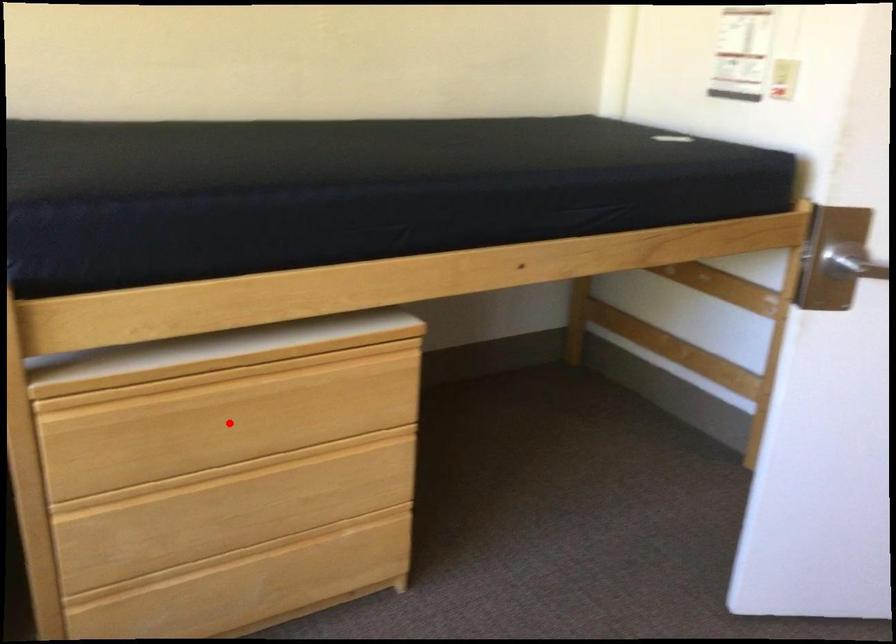
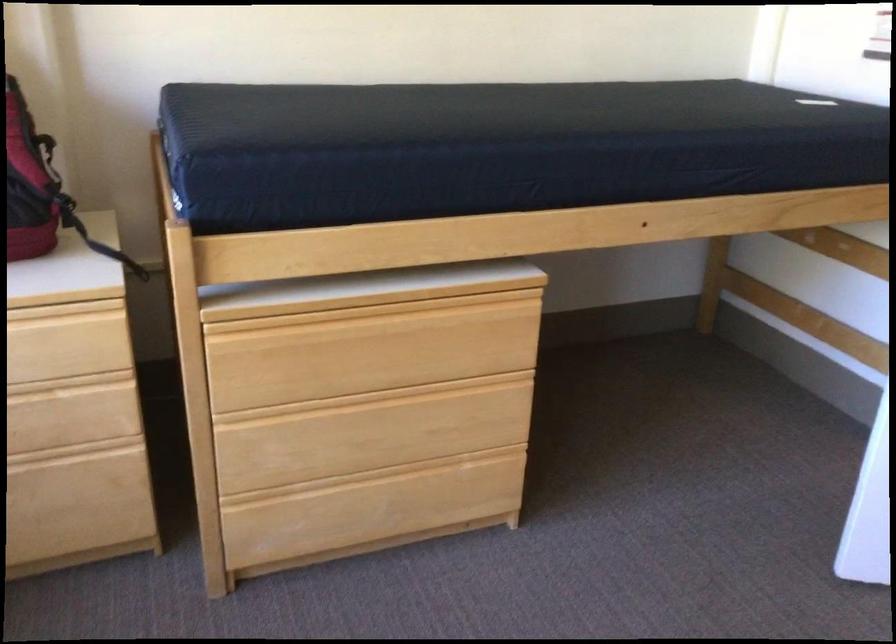
The point at the highlighted location is marked in the first image. Where is the corresponding point in the second image?

(369, 353)